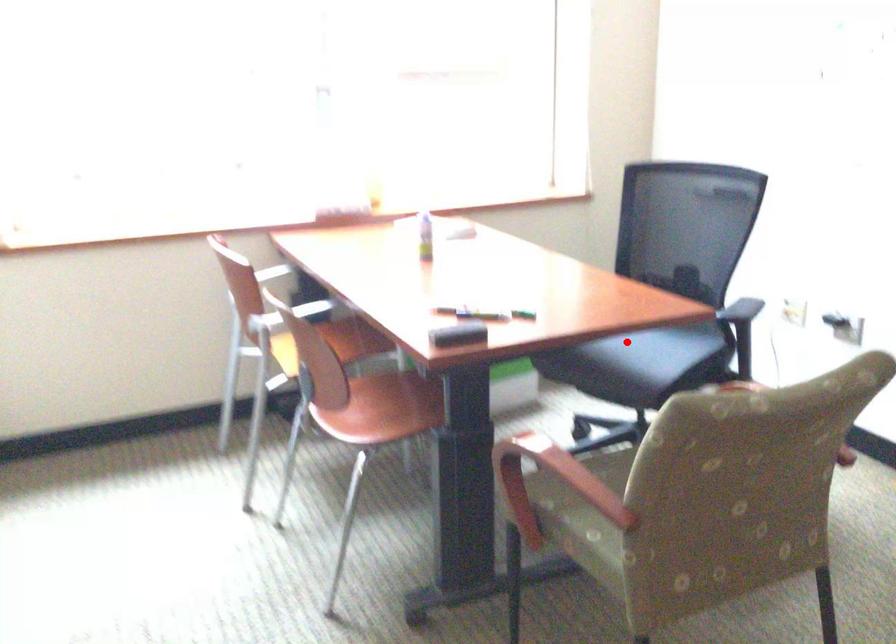
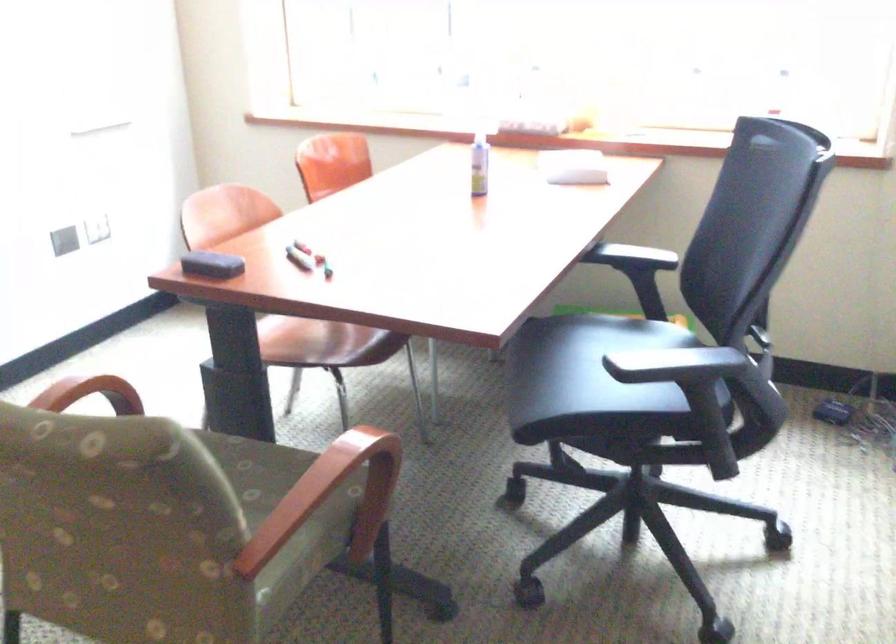
Find the pixel in the second image that matches the highlighted location in the first image.

(591, 361)